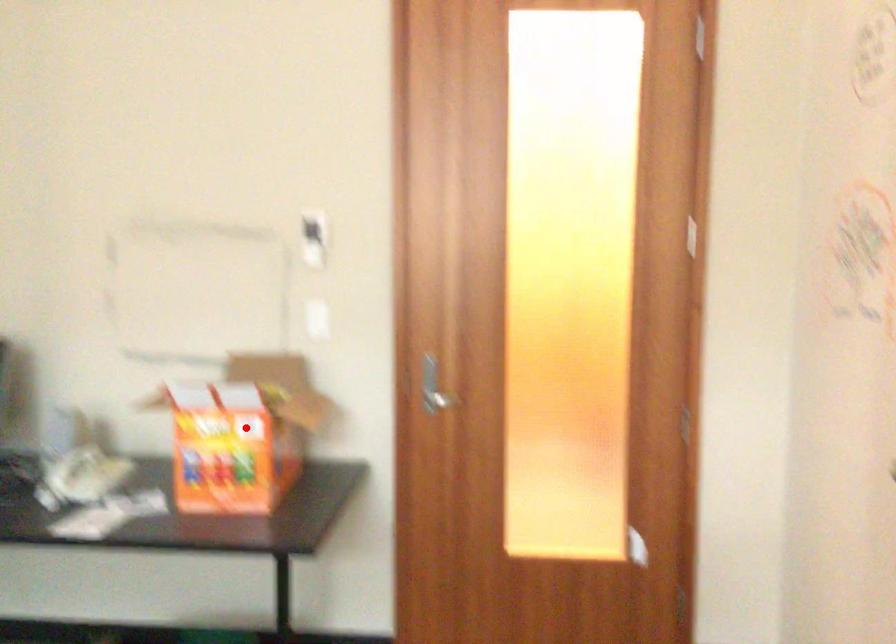
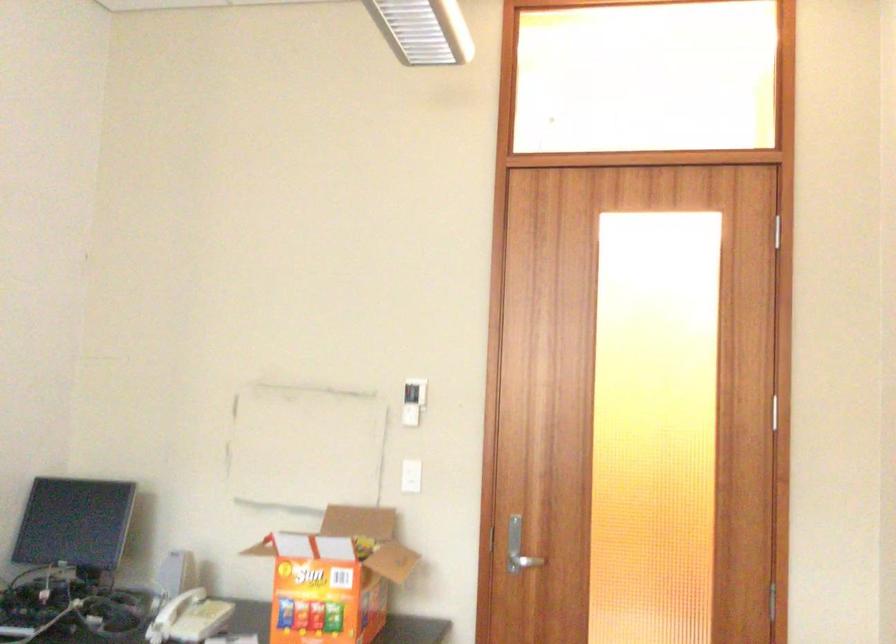
Locate, in the second image, the point that corresponds to the highlighted location in the first image.

(334, 576)